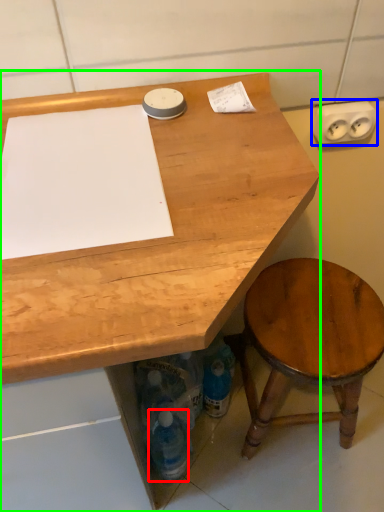
Question: Which object is the farthest from bottle (highlighted by a red box)? Choose among these: electric outlet (highlighted by a blue box) or desk (highlighted by a green box).

Choices:
 (A) electric outlet
 (B) desk

Answer: (A)